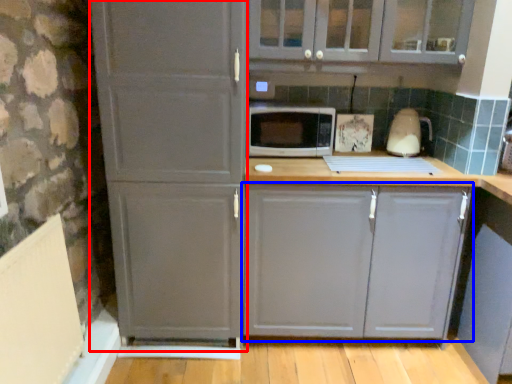
Question: Which object is further to the camera taking this photo, screen door (highlighted by a red box) or cabinetry (highlighted by a blue box)?

Choices:
 (A) screen door
 (B) cabinetry

Answer: (B)